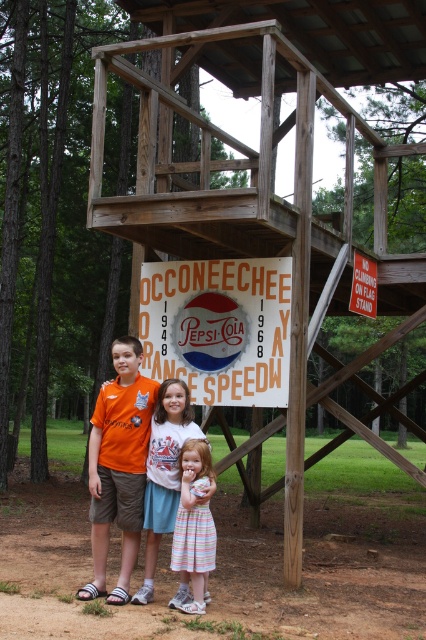
Question: In this image, where is wooden at center located relative to orange t-shirt at center?

Choices:
 (A) right
 (B) left

Answer: (A)

Question: In this image, where is white paper sign at center located relative to white cotton dress at center?

Choices:
 (A) below
 (B) above

Answer: (B)

Question: Which is nearer to the white paper sign at center?

Choices:
 (A) white cotton dress at center
 (B) orange t-shirt at center
 (C) striped cotton dress at center

Answer: (B)

Question: Which of the following is the closest to the observer?

Choices:
 (A) (101, 524)
 (B) (161, 426)

Answer: (A)

Question: Among these points, which one is farthest from the camera?

Choices:
 (A) (180, 170)
 (B) (256, 275)
 (C) (173, 456)
 (D) (183, 564)

Answer: (A)

Question: Does wooden at center come in front of white cotton dress at center?

Choices:
 (A) yes
 (B) no

Answer: (B)